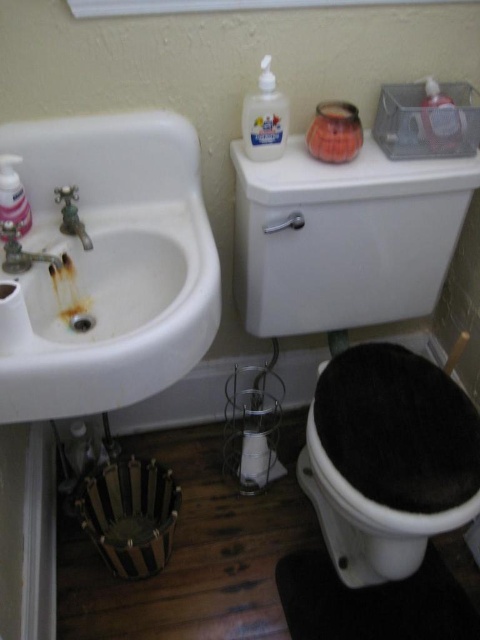
Question: Is white glossy sink at left bigger than clear plastic bottle at upper center?

Choices:
 (A) yes
 (B) no

Answer: (A)

Question: Is clear plastic bottle at upper center below translucent plastic soap dispenser at left?

Choices:
 (A) no
 (B) yes

Answer: (A)

Question: Which of the following is the farthest from the observer?

Choices:
 (A) rusty metal faucet at left
 (B) clear plastic bottle at upper center
 (C) black fuzzy toilet bowl at lower right
 (D) white glossy sink at left

Answer: (B)

Question: Can you confirm if clear plastic bottle at upper center is positioned to the right of rusty metal faucet at left?

Choices:
 (A) no
 (B) yes

Answer: (B)

Question: Which object is closer to the camera taking this photo?

Choices:
 (A) clear plastic bottle at upper center
 (B) brushed metal faucet at sink left

Answer: (B)

Question: Which object is farther from the camera taking this photo?

Choices:
 (A) brushed metal faucet at sink left
 (B) translucent plastic soap dispenser at left
 (C) clear plastic bottle at upper center
 (D) rusty metal faucet at left

Answer: (C)